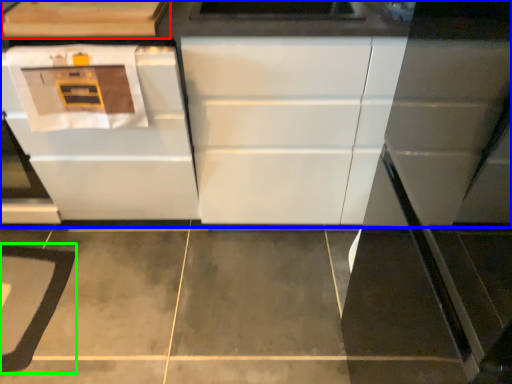
Question: Considering the real-world distances, which object is closest to cabinetry (highlighted by a red box)? cabinetry (highlighted by a blue box) or mat (highlighted by a green box).

Choices:
 (A) cabinetry
 (B) mat

Answer: (A)